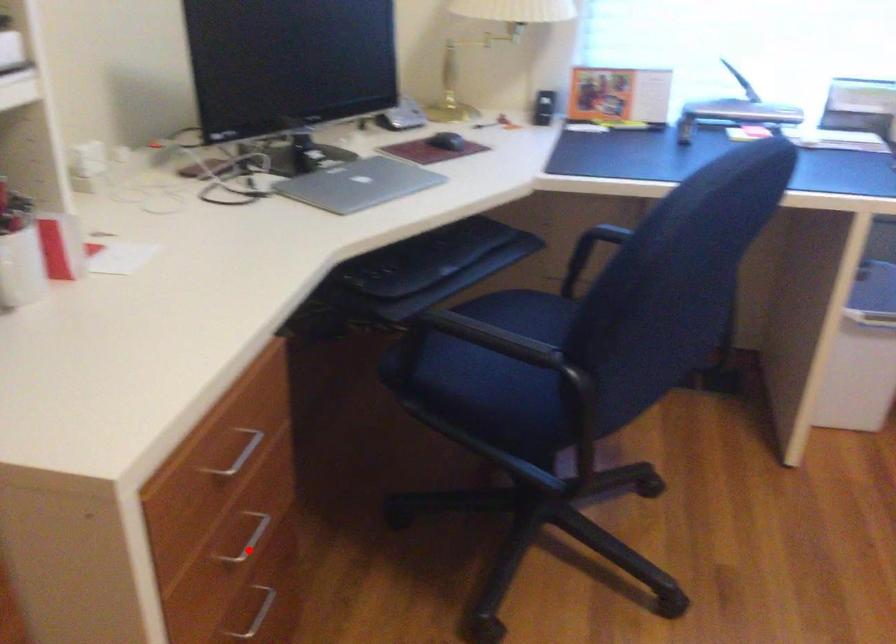
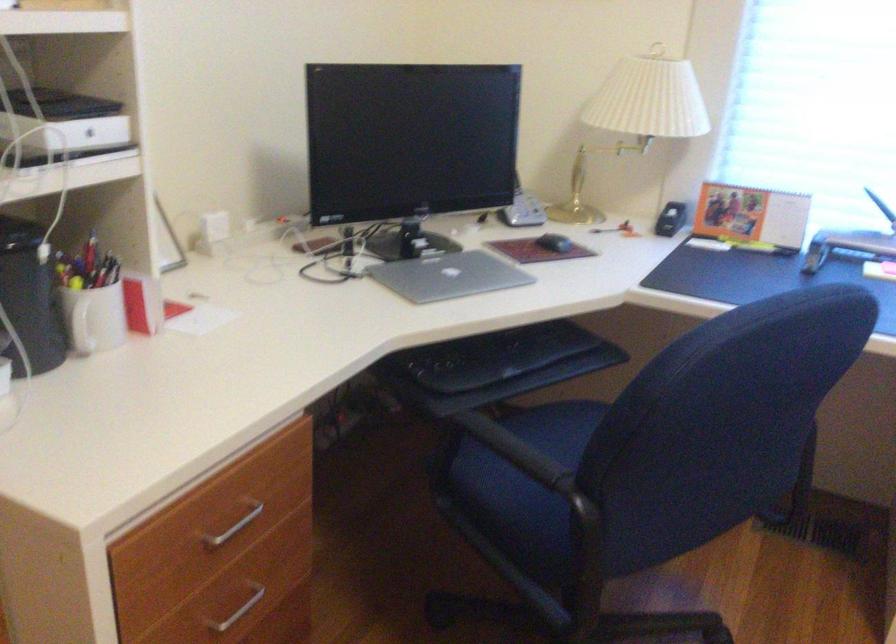
Where in the second image is the point corresponding to the highlighted location from the first image?

(238, 611)